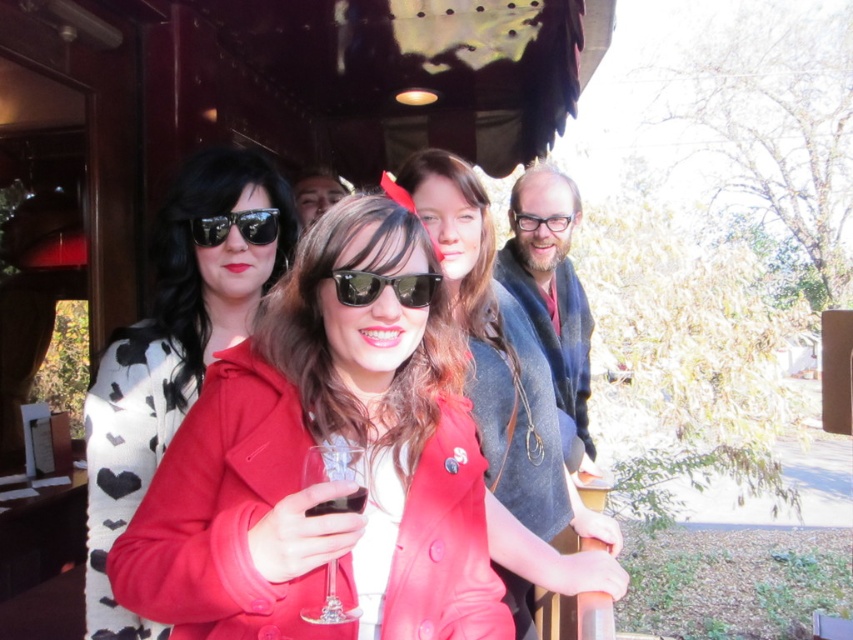
Question: Estimate the real-world distances between objects in this image. Which object is farther from the matte black sunglasses at left?

Choices:
 (A) sunglasses at center
 (B) clear glass wine glass at center

Answer: (B)

Question: Which object is the closest to the matte black sunglasses at upper center?

Choices:
 (A) matte black glasses at center
 (B) matte leather jacket at center

Answer: (A)

Question: From the image, what is the correct spatial relationship of clear glass wine glass at center in relation to black reflective sunglasses at center?

Choices:
 (A) right
 (B) left

Answer: (A)

Question: Does matte black sunglasses at left have a lesser width compared to matte red coat at center?

Choices:
 (A) no
 (B) yes

Answer: (B)

Question: Based on their relative distances, which object is nearer to the sunglasses at center?

Choices:
 (A) black reflective sunglasses at center
 (B) matte black sunglasses at left
 (C) matte leather jacket at center

Answer: (C)

Question: Does matte leather jacket at center appear under black reflective sunglasses at center?

Choices:
 (A) yes
 (B) no

Answer: (A)